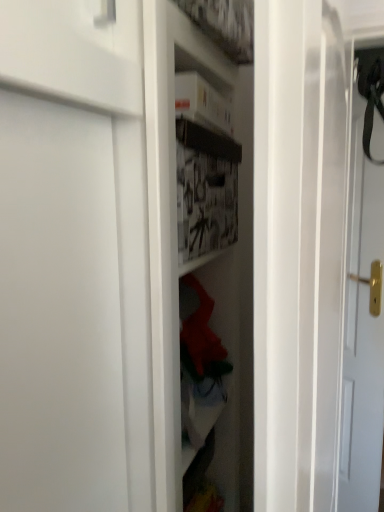
What do you see at coordinates (364, 293) in the screenshot? This screenshot has height=512, width=384. I see `matte white door at right` at bounding box center [364, 293].

Image resolution: width=384 pixels, height=512 pixels. I want to click on matte white door at right, so click(x=364, y=293).

Where is `matte white door at right`? matte white door at right is located at coordinates (364, 293).